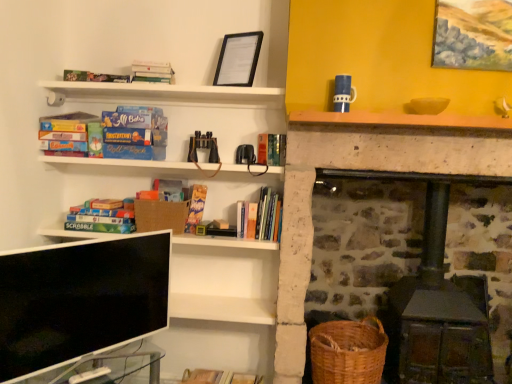
Question: Should I look upward or downward to see matte green board game at left, the 5th book when ordered from top to bottom?

Choices:
 (A) up
 (B) down

Answer: (B)

Question: Can you confirm if hardcover book at center, the 5th book viewed from the left, is shorter than burlap basket at lower left, which is counted as the 1th basket, starting from the top?

Choices:
 (A) yes
 (B) no

Answer: (A)

Question: From a real-world perspective, is hardcover book at center, the second book in the bottom-to-top sequence, located beneath burlap basket at lower left, the second basket viewed from the right?

Choices:
 (A) no
 (B) yes

Answer: (A)

Question: Can you confirm if hardcover book at center, the second book in the bottom-to-top sequence, is wider than burlap basket at lower left, the second basket viewed from the right?

Choices:
 (A) yes
 (B) no

Answer: (B)

Question: Are hardcover book at center, the 5th book viewed from the left, and burlap basket at lower left, placed as the 2th basket when sorted from bottom to top, beside each other?

Choices:
 (A) no
 (B) yes

Answer: (A)

Question: Does hardcover book at center, which is the 1th book in right-to-left order, have a larger size compared to burlap basket at lower left, which is counted as the 1th basket, starting from the top?

Choices:
 (A) no
 (B) yes

Answer: (A)

Question: Does hardcover book at center, the second book in the bottom-to-top sequence, have a greater height compared to burlap basket at lower left, the second basket viewed from the right?

Choices:
 (A) no
 (B) yes

Answer: (A)

Question: Is black matte picture frame at upper center, which is the second picture frame from right to left, closer to camera compared to oil painting at upper right, placed as the 1th picture frame when sorted from front to back?

Choices:
 (A) yes
 (B) no

Answer: (B)

Question: Would you say oil painting at upper right, acting as the second picture frame starting from the left, is part of black matte picture frame at upper center, which is the 1th picture frame in left-to-right order,'s contents?

Choices:
 (A) no
 (B) yes

Answer: (A)

Question: From the image's perspective, would you say black matte picture frame at upper center, which is the second picture frame from right to left, is shown under oil painting at upper right, placed as the 1th picture frame when sorted from front to back?

Choices:
 (A) yes
 (B) no

Answer: (A)

Question: Is the position of black matte picture frame at upper center, which is the second picture frame from right to left, more distant than that of oil painting at upper right, the second picture frame when ordered from back to front?

Choices:
 (A) no
 (B) yes

Answer: (B)

Question: Is black matte picture frame at upper center, which is the second picture frame from right to left, oriented towards oil painting at upper right, the second picture frame when ordered from back to front?

Choices:
 (A) yes
 (B) no

Answer: (B)

Question: Is black matte picture frame at upper center, which is the 1th picture frame in left-to-right order, to the right of oil painting at upper right, acting as the second picture frame starting from the left, from the viewer's perspective?

Choices:
 (A) no
 (B) yes

Answer: (A)

Question: Are matte cardboard board game at left, marked as the fifth book in a right-to-left arrangement, and hardcover book at upper left, which is the 4th book in bottom-to-top order, located far from each other?

Choices:
 (A) no
 (B) yes

Answer: (A)